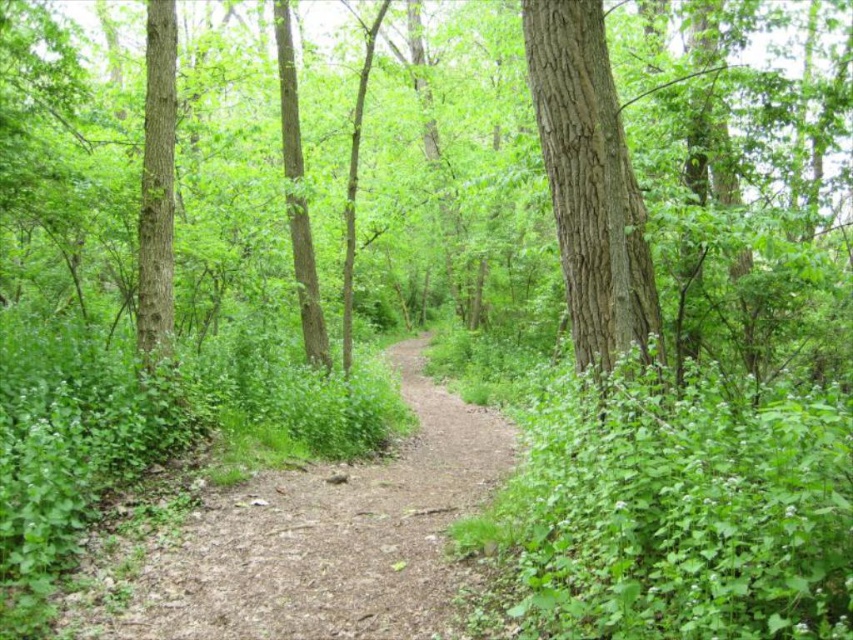
Is brown dirt path at center to the left of brown textured bark tree at center from the viewer's perspective?

Indeed, brown dirt path at center is positioned on the left side of brown textured bark tree at center.

Find the location of a particular element. Image resolution: width=853 pixels, height=640 pixels. brown dirt path at center is located at coordinates (312, 540).

Can you confirm if brown textured bark tree at center is smaller than smooth brown tree trunk at left?

Actually, brown textured bark tree at center might be larger than smooth brown tree trunk at left.

Can you confirm if brown textured bark tree at center is wider than smooth brown tree trunk at left?

Correct, the width of brown textured bark tree at center exceeds that of smooth brown tree trunk at left.

The image size is (853, 640). I want to click on brown textured bark tree at center, so click(x=589, y=182).

This screenshot has height=640, width=853. What are the coordinates of `brown textured bark tree at center` in the screenshot? It's located at (589, 182).

Does brown rough tree at center have a greater width compared to smooth brown tree trunk at left?

Yes, brown rough tree at center is wider than smooth brown tree trunk at left.

Can you confirm if brown rough tree at center is thinner than smooth brown tree trunk at left?

No, brown rough tree at center is not thinner than smooth brown tree trunk at left.

Which is in front, point (20, 128) or point (148, 182)?

Positioned in front is point (148, 182).

Find the location of a particular element. Image resolution: width=853 pixels, height=640 pixels. brown rough tree at center is located at coordinates (747, 186).